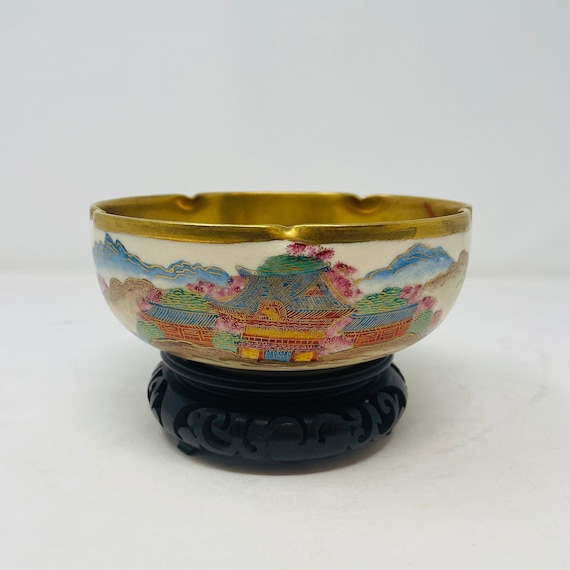
The width and height of the screenshot is (570, 570). In order to click on empty space right of bowl in this screenshot , I will do `click(518, 317)`.